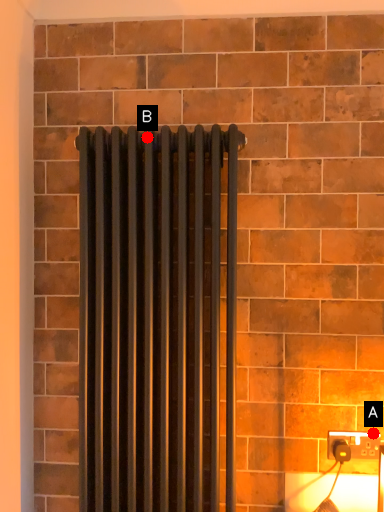
Question: Two points are circled on the image, labeled by A and B beside each circle. Which point is farther from the camera taking this photo?

Choices:
 (A) A is further
 (B) B is further

Answer: (A)